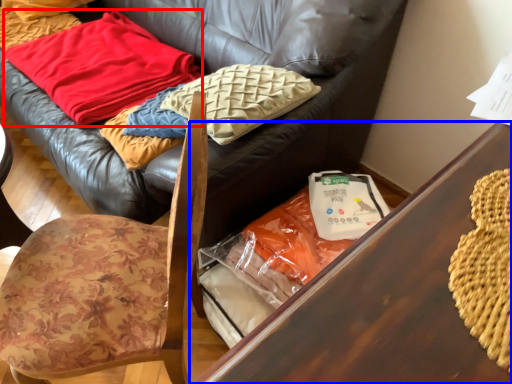
Question: Which object is further to the camera taking this photo, blanket (highlighted by a red box) or table (highlighted by a blue box)?

Choices:
 (A) blanket
 (B) table

Answer: (A)